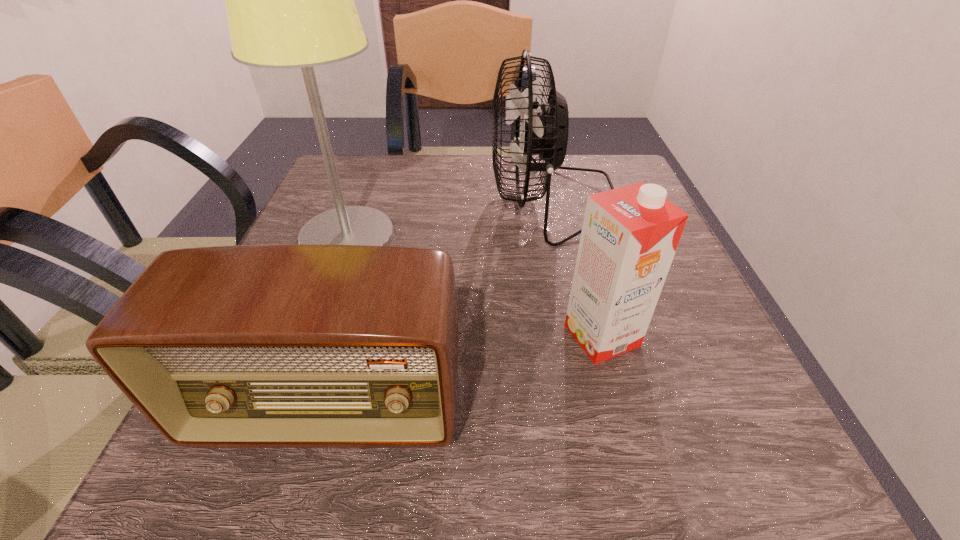
Where is `the tallest object`? the tallest object is located at coordinates (289, 0).

I want to click on the second tallest object, so click(x=544, y=131).

You are a GUI agent. You are given a task and a screenshot of the screen. Output one action in this format:
    pyautogui.click(x=<x>, y=<y>)
    Task: Click on the carton
    The width and height of the screenshot is (960, 540).
    Given the screenshot: What is the action you would take?
    pyautogui.click(x=630, y=234)

You are a GUI agent. You are given a task and a screenshot of the screen. Output one action in this format:
    pyautogui.click(x=<x>, y=<y>)
    Task: Click on the nearest object
    This screenshot has height=540, width=960.
    Given the screenshot: What is the action you would take?
    pyautogui.click(x=291, y=345)

At what (x,y) coordinates should I click in order to perform the action: click on vacant space situated on the front of the tallest object. Please return your answer as a coordinate pair (x, y). This screenshot has height=540, width=960. Looking at the image, I should click on (290, 396).

Identify the location of blank space located in front of the fan, directing airflow. (420, 201).

Identify the location of free region located in front of the fan, directing airflow. (380, 201).

Locate an element on the screen. vacant space located 0.260m in front of the fan, directing airflow is located at coordinates tap(376, 201).

Find the location of `free spot located on the back of the carton`. free spot located on the back of the carton is located at coordinates (564, 194).

What are the coordinates of `object present at the far edge` in the screenshot? It's located at (544, 131).